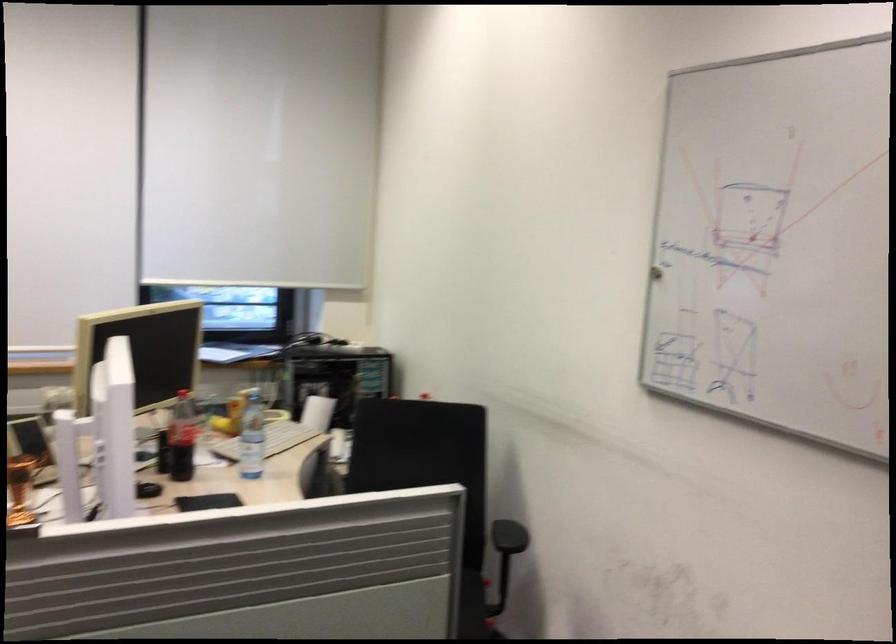
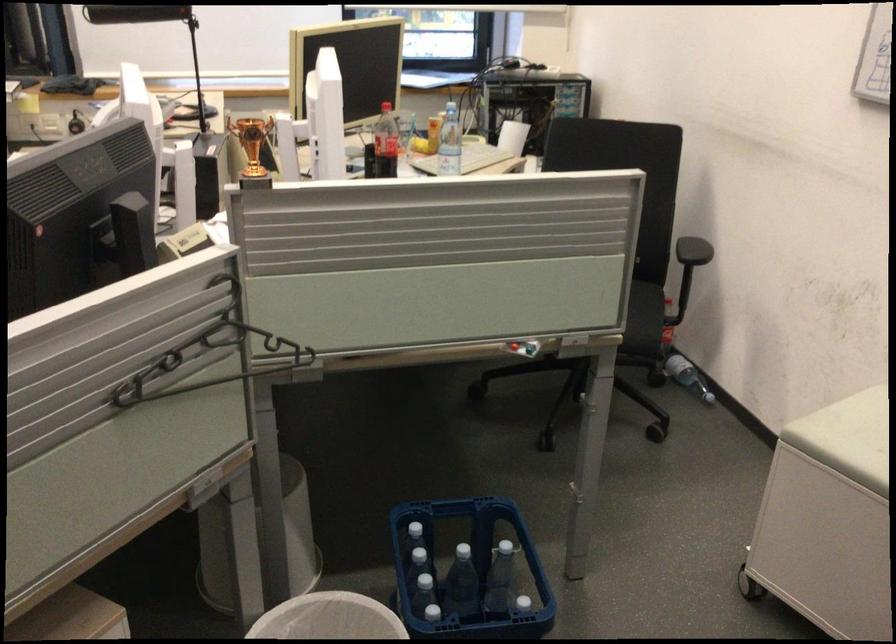
The point at (177, 431) is marked in the first image. Where is the corresponding point in the second image?

(385, 143)